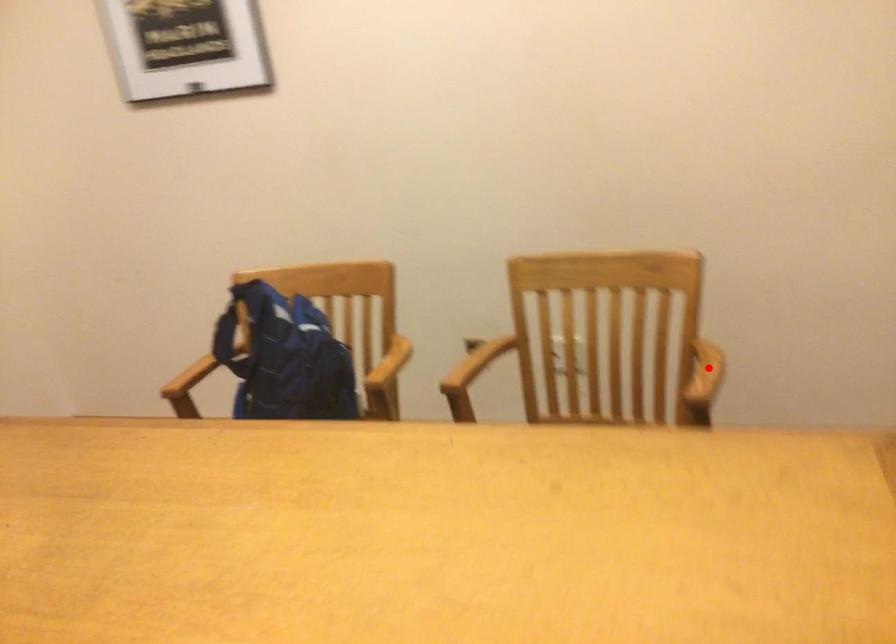
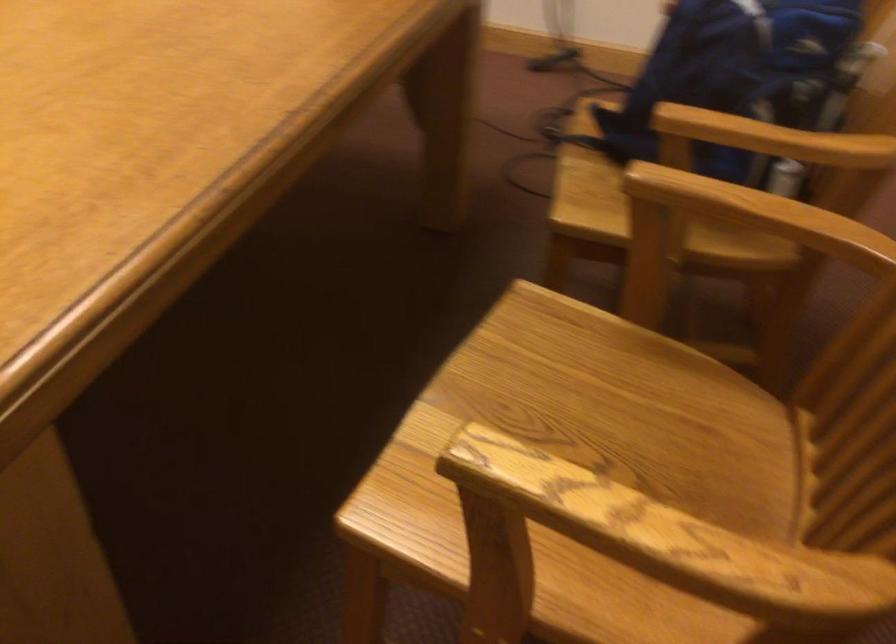
Where in the second image is the point corresponding to the highlighted location from the first image?

(658, 542)